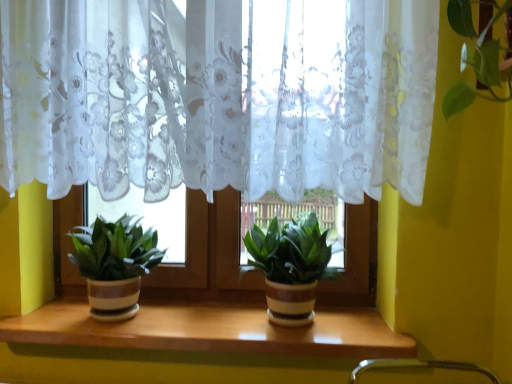
Find the location of `green matte plant pot at center, positioned as the 2th houseplant in left-to-right order`. green matte plant pot at center, positioned as the 2th houseplant in left-to-right order is located at coordinates (291, 266).

Describe the element at coordinates (218, 96) in the screenshot. I see `white lace curtain at upper center` at that location.

Where is `green matte plant pot at center, positioned as the 2th houseplant in left-to-right order`? Image resolution: width=512 pixels, height=384 pixels. green matte plant pot at center, positioned as the 2th houseplant in left-to-right order is located at coordinates (291, 266).

From a real-world perspective, who is located higher, green matte plant pot at center, positioned as the 2th houseplant in left-to-right order, or wooden at center?

In real-world perspective, green matte plant pot at center, positioned as the 2th houseplant in left-to-right order, is above.

Considering the relative sizes of green matte plant pot at center, the first houseplant in the right-to-left sequence, and wooden at center in the image provided, is green matte plant pot at center, the first houseplant in the right-to-left sequence, shorter than wooden at center?

In fact, green matte plant pot at center, the first houseplant in the right-to-left sequence, may be taller than wooden at center.

Between green matte plant pot at center, the first houseplant in the right-to-left sequence, and wooden at center, which one has smaller width?

With smaller width is green matte plant pot at center, the first houseplant in the right-to-left sequence.

From the image's perspective, which is below, green matte plant pot at center, the first houseplant in the right-to-left sequence, or wooden at center?

wooden at center.

Which is behind, point (292, 265) or point (222, 86)?

The point (292, 265) is farther from the camera.

Could you measure the distance between green matte plant pot at center, the first houseplant in the right-to-left sequence, and white lace curtain at upper center?

green matte plant pot at center, the first houseplant in the right-to-left sequence, and white lace curtain at upper center are 15.96 inches apart from each other.

Is green matte plant pot at center, positioned as the 2th houseplant in left-to-right order, facing towards white lace curtain at upper center?

No, green matte plant pot at center, positioned as the 2th houseplant in left-to-right order, does not turn towards white lace curtain at upper center.

In terms of height, does green matte plant pot at center, positioned as the 2th houseplant in left-to-right order, look taller or shorter compared to white lace curtain at upper center?

Clearly, green matte plant pot at center, positioned as the 2th houseplant in left-to-right order, is shorter compared to white lace curtain at upper center.

Is wooden at center at the back of green matte plant pot at left, the first houseplant positioned from the left?

No, green matte plant pot at left, the first houseplant positioned from the left, is not facing the opposite direction of wooden at center.

Is green matte plant pot at left, which is the second houseplant in right-to-left order, thinner than wooden at center?

Indeed, green matte plant pot at left, which is the second houseplant in right-to-left order, has a lesser width compared to wooden at center.

From their relative heights in the image, would you say green matte plant pot at left, which is the second houseplant in right-to-left order, is taller or shorter than wooden at center?

Clearly, green matte plant pot at left, which is the second houseplant in right-to-left order, is taller compared to wooden at center.

Between green matte plant pot at left, the first houseplant positioned from the left, and wooden at center, which one is positioned behind?

green matte plant pot at left, the first houseplant positioned from the left, is further from the camera.

Where is `window sill located behind the white lace curtain at upper center`? Image resolution: width=512 pixels, height=384 pixels. window sill located behind the white lace curtain at upper center is located at coordinates (210, 327).

From a real-world perspective, between wooden at center and white lace curtain at upper center, who is vertically lower?

wooden at center, from a real-world perspective.

Is white lace curtain at upper center inside wooden at center?

No, white lace curtain at upper center is not surrounded by wooden at center.

Who is shorter, wooden at center or white lace curtain at upper center?

With less height is wooden at center.

Who is bigger, white lace curtain at upper center or green matte plant pot at center, positioned as the 2th houseplant in left-to-right order?

white lace curtain at upper center is bigger.

How much distance is there between white lace curtain at upper center and green matte plant pot at center, the first houseplant in the right-to-left sequence?

white lace curtain at upper center and green matte plant pot at center, the first houseplant in the right-to-left sequence, are 15.96 inches apart from each other.

Does white lace curtain at upper center touch green matte plant pot at center, positioned as the 2th houseplant in left-to-right order?

white lace curtain at upper center and green matte plant pot at center, positioned as the 2th houseplant in left-to-right order, are clearly separated.

Could you tell me if white lace curtain at upper center is turned towards green matte plant pot at center, the first houseplant in the right-to-left sequence?

No, white lace curtain at upper center is not aimed at green matte plant pot at center, the first houseplant in the right-to-left sequence.

Which is closer to the camera, (104, 222) or (297, 118)?

Point (104, 222) is positioned farther from the camera compared to point (297, 118).

From the image's perspective, is green matte plant pot at left, which is the second houseplant in right-to-left order, on top of white lace curtain at upper center?

No, from the image's perspective, green matte plant pot at left, which is the second houseplant in right-to-left order, is not on top of white lace curtain at upper center.

Considering the sizes of objects green matte plant pot at left, the first houseplant positioned from the left, and white lace curtain at upper center in the image provided, who is shorter, green matte plant pot at left, the first houseplant positioned from the left, or white lace curtain at upper center?

green matte plant pot at left, the first houseplant positioned from the left, is shorter.

Which object is positioned more to the right, green matte plant pot at left, which is the second houseplant in right-to-left order, or white lace curtain at upper center?

Positioned to the right is white lace curtain at upper center.

Based on their sizes in the image, would you say wooden at center is bigger or smaller than green matte plant pot at left, which is the second houseplant in right-to-left order?

wooden at center is smaller than green matte plant pot at left, which is the second houseplant in right-to-left order.

Based on the photo, how much distance is there between wooden at center and green matte plant pot at left, which is the second houseplant in right-to-left order?

wooden at center and green matte plant pot at left, which is the second houseplant in right-to-left order, are 23.83 centimeters apart.

The image size is (512, 384). What are the coordinates of `houseplant to the left of wooden at center` in the screenshot? It's located at (114, 264).

Is green matte plant pot at left, which is the second houseplant in right-to-left order, at the back of wooden at center?

wooden at center does not have its back to green matte plant pot at left, which is the second houseplant in right-to-left order.

In order to click on houseplant that appears in front of the wooden at center in this screenshot , I will do `click(291, 266)`.

You are a GUI agent. You are given a task and a screenshot of the screen. Output one action in this format:
    pyautogui.click(x=<x>, y=<y>)
    Task: Click on the houseplant that is the 1st object located behind the white lace curtain at upper center
    
    Given the screenshot: What is the action you would take?
    pyautogui.click(x=291, y=266)

Which object lies further to the anchor point white lace curtain at upper center, wooden at center or green matte plant pot at center, the first houseplant in the right-to-left sequence?

wooden at center.

Looking at the image, which one is located closer to green matte plant pot at center, positioned as the 2th houseplant in left-to-right order, green matte plant pot at left, which is the second houseplant in right-to-left order, or white lace curtain at upper center?

Based on the image, white lace curtain at upper center appears to be nearer to green matte plant pot at center, positioned as the 2th houseplant in left-to-right order.

From the image, which object appears to be nearer to white lace curtain at upper center, green matte plant pot at center, positioned as the 2th houseplant in left-to-right order, or wooden at center?

Based on the image, green matte plant pot at center, positioned as the 2th houseplant in left-to-right order, appears to be nearer to white lace curtain at upper center.

From the picture: When comparing their distances from white lace curtain at upper center, does green matte plant pot at left, which is the second houseplant in right-to-left order, or green matte plant pot at center, the first houseplant in the right-to-left sequence, seem closer?

green matte plant pot at center, the first houseplant in the right-to-left sequence, is closer to white lace curtain at upper center.

Estimate the real-world distances between objects in this image. Which object is further from green matte plant pot at left, which is the second houseplant in right-to-left order, wooden at center or white lace curtain at upper center?

white lace curtain at upper center lies further to green matte plant pot at left, which is the second houseplant in right-to-left order, than the other object.

Based on their spatial positions, is wooden at center or white lace curtain at upper center closer to green matte plant pot at center, the first houseplant in the right-to-left sequence?

The object closer to green matte plant pot at center, the first houseplant in the right-to-left sequence, is wooden at center.

Looking at the image, which one is located further to white lace curtain at upper center, green matte plant pot at left, which is the second houseplant in right-to-left order, or wooden at center?

wooden at center.

Considering their positions, is white lace curtain at upper center positioned closer to green matte plant pot at center, positioned as the 2th houseplant in left-to-right order, than green matte plant pot at left, the first houseplant positioned from the left?

white lace curtain at upper center.

You are a GUI agent. You are given a task and a screenshot of the screen. Output one action in this format:
    pyautogui.click(x=<x>, y=<y>)
    Task: Click on the houseplant that lies between white lace curtain at upper center and green matte plant pot at center, positioned as the 2th houseplant in left-to-right order, from top to bottom
    This screenshot has height=384, width=512.
    Given the screenshot: What is the action you would take?
    pyautogui.click(x=114, y=264)

Find the location of a particular element. window sill situated between green matte plant pot at left, which is the second houseplant in right-to-left order, and green matte plant pot at center, positioned as the 2th houseplant in left-to-right order, from left to right is located at coordinates (210, 327).